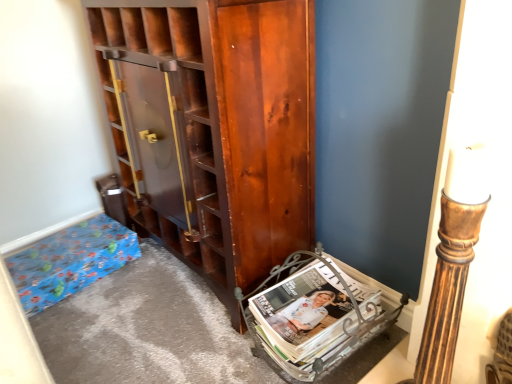
Question: Considering the positions of point (54, 264) and point (359, 314), is point (54, 264) closer or farther from the camera than point (359, 314)?

Choices:
 (A) closer
 (B) farther

Answer: (B)

Question: From their relative heights in the image, would you say blue paper bag at lower left is taller or shorter than matte metallic magazine rack at lower right?

Choices:
 (A) short
 (B) tall

Answer: (A)

Question: Which is nearer to the shiny brown cabinet at center?

Choices:
 (A) blue paper bag at lower left
 (B) matte metallic magazine rack at lower right

Answer: (B)

Question: Which is farther from the shiny brown cabinet at center?

Choices:
 (A) blue paper bag at lower left
 (B) matte metallic magazine rack at lower right

Answer: (A)